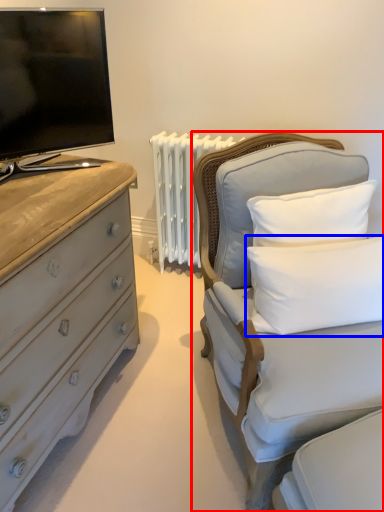
Question: Which point is closer to the camera, furniture (highlighted by a red box) or pillow (highlighted by a blue box)?

Choices:
 (A) furniture
 (B) pillow

Answer: (A)